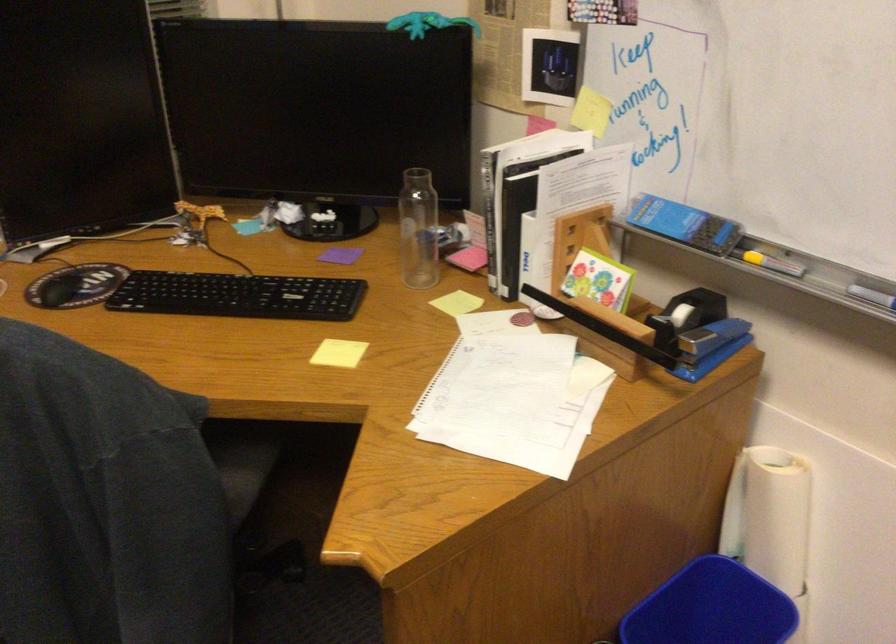
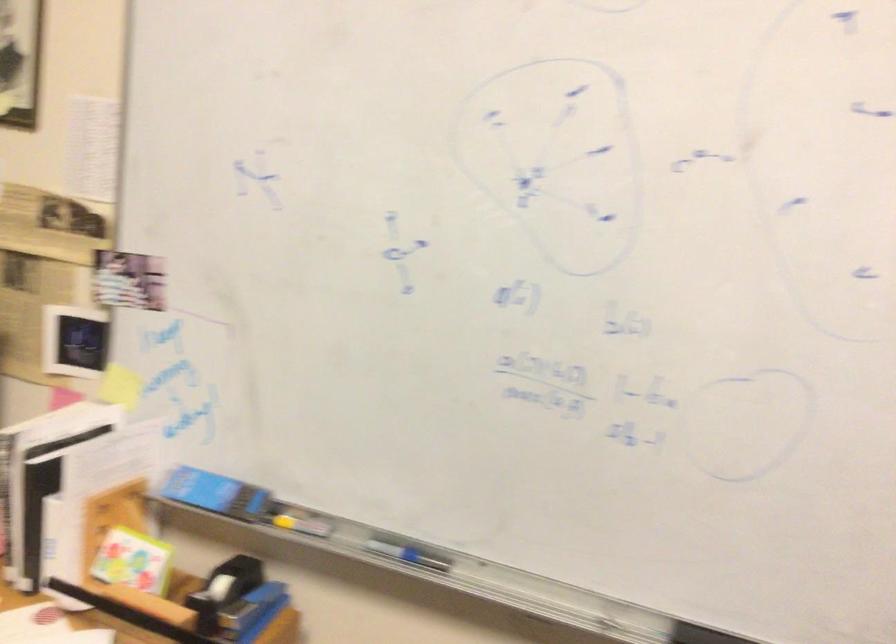
Question: Based on the continuous images, in which direction is the camera rotating? Reply with the corresponding letter.

Choices:
 (A) Left
 (B) Right
 (C) Up
 (D) Down

Answer: (B)